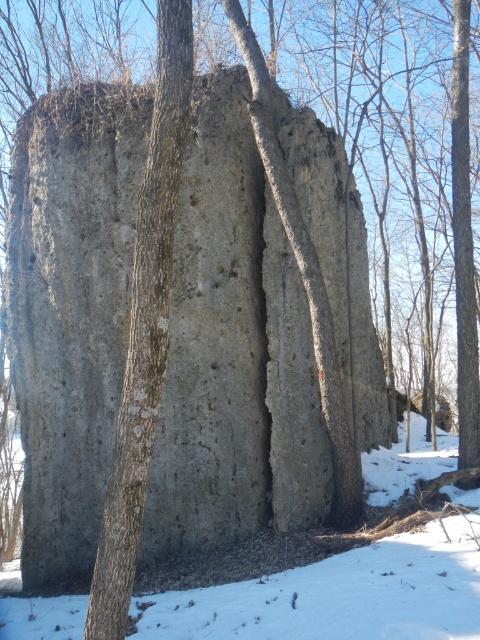
Which is behind, point (205, 426) or point (126, 413)?

The point (205, 426) is more distant.

Does gray rough rock at center have a greater height compared to smooth gray bark at center?

No, gray rough rock at center is not taller than smooth gray bark at center.

Does point (197, 385) come behind point (118, 600)?

Yes, point (197, 385) is farther from viewer.

Locate an element on the screen. The width and height of the screenshot is (480, 640). gray rough rock at center is located at coordinates (232, 352).

Can you confirm if gray rough rock at center is positioned above white powdery snow at lower center?

Correct, gray rough rock at center is located above white powdery snow at lower center.

Is point (211, 202) in front of point (454, 548)?

No, (211, 202) is behind (454, 548).

Between point (332, 157) and point (365, 556), which one is positioned in front?

Point (365, 556)

Locate an element on the screen. gray rough rock at center is located at coordinates (232, 352).

From the picture: Is white powdery snow at lower center positioned behind smooth gray bark at center?

Yes, it is.

Is point (78, 605) behind point (164, 6)?

That is True.

This screenshot has width=480, height=640. Identify the location of white powdery snow at lower center. (337, 595).